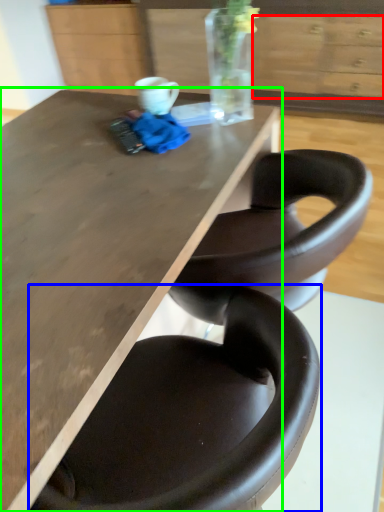
Question: Considering the real-world distances, which object is farthest from drawer (highlighted by a red box)? chair (highlighted by a blue box) or table (highlighted by a green box)?

Choices:
 (A) chair
 (B) table

Answer: (A)